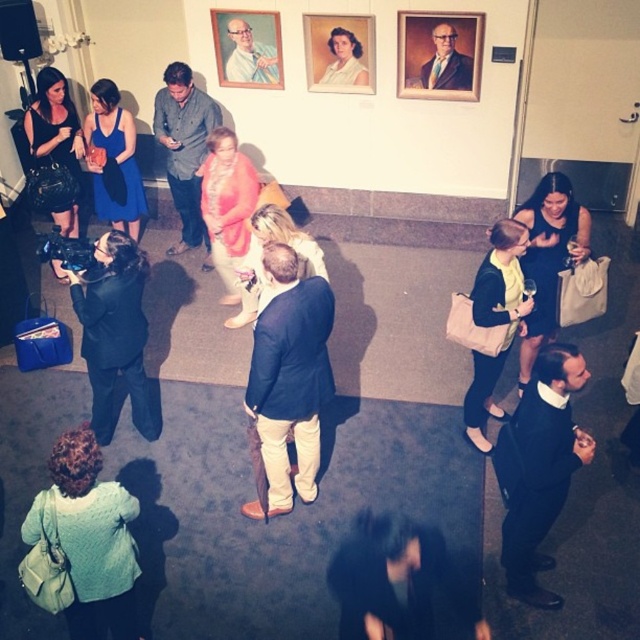
Question: Observing the image, what is the correct spatial positioning of blue satin dress at center in reference to smooth white blouse at center?

Choices:
 (A) above
 (B) below

Answer: (B)

Question: Which object appears farthest from the camera in this image?

Choices:
 (A) wooden portrait frame at upper center
 (B) pink satin dress at center

Answer: (A)

Question: Does smooth white shirt at center have a smaller size compared to smooth white blouse at center?

Choices:
 (A) yes
 (B) no

Answer: (B)

Question: Which point appears closest to the camera in this image?

Choices:
 (A) [250, 72]
 (B) [490, 296]

Answer: (B)

Question: Which point is closer to the camera?

Choices:
 (A) pink satin dress at center
 (B) matte black dress at left
 (C) blue satin dress at center

Answer: (A)

Question: Is matte black blazer at center smaller than matte black dress at left?

Choices:
 (A) yes
 (B) no

Answer: (B)